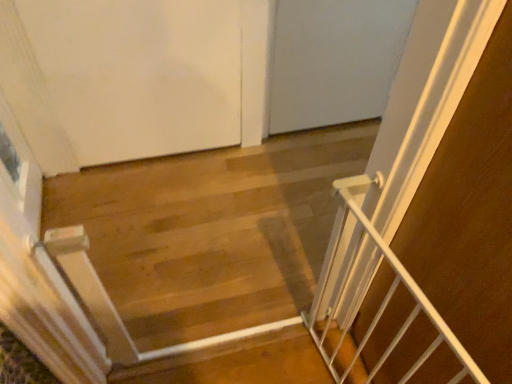
Locate an element on the screen. vacant space to the right of white matte door at upper left is located at coordinates (253, 191).